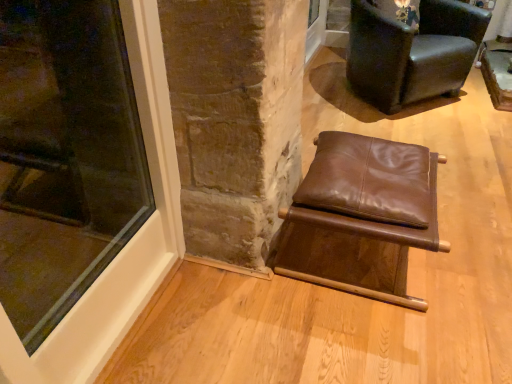
This screenshot has height=384, width=512. I want to click on vacant region to the left of brown leather stool at center, marked as the 2th chair in a back-to-front arrangement, so click(x=230, y=296).